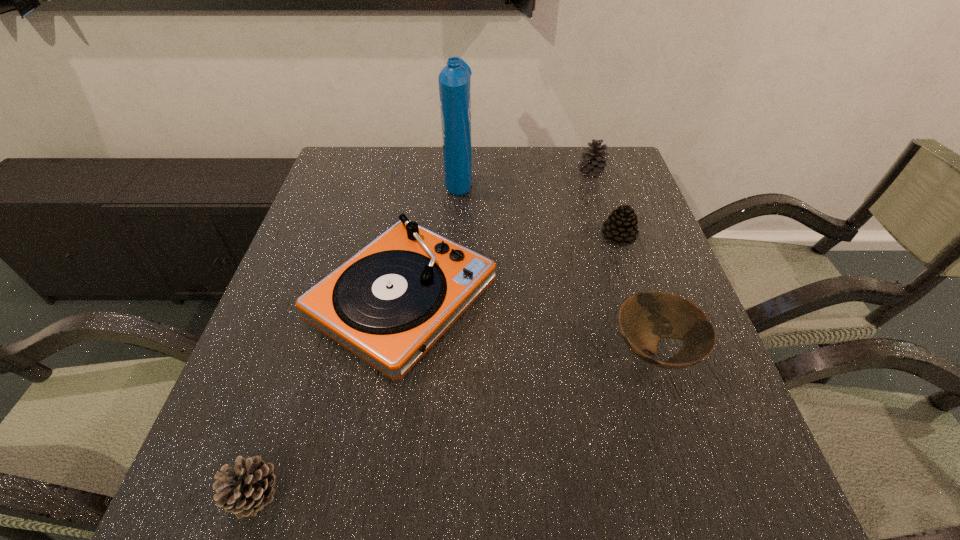
Where is `object situated at the far right corner`? object situated at the far right corner is located at coordinates (593, 163).

Locate an element on the screen. This screenshot has width=960, height=540. vacant region at the far edge of the desktop is located at coordinates (558, 163).

In the image, there is a desktop. Identify the location of free space at the near edge. (608, 470).

Identify the location of free space at the left edge. The height and width of the screenshot is (540, 960). (355, 208).

I want to click on free space at the right edge of the desktop, so click(x=675, y=286).

The width and height of the screenshot is (960, 540). In the image, there is a desktop. Identify the location of vacant space at the far right corner. (585, 189).

The image size is (960, 540). I want to click on free point at the near right corner, so click(x=739, y=516).

In order to click on empty location between the bowl and the tallest object in this screenshot , I will do `click(557, 264)`.

Find the location of a particular element. free space between the record player and the second nearest pinecone is located at coordinates (511, 268).

Find the location of a particular element. free space between the tallest object and the farthest pinecone is located at coordinates (525, 176).